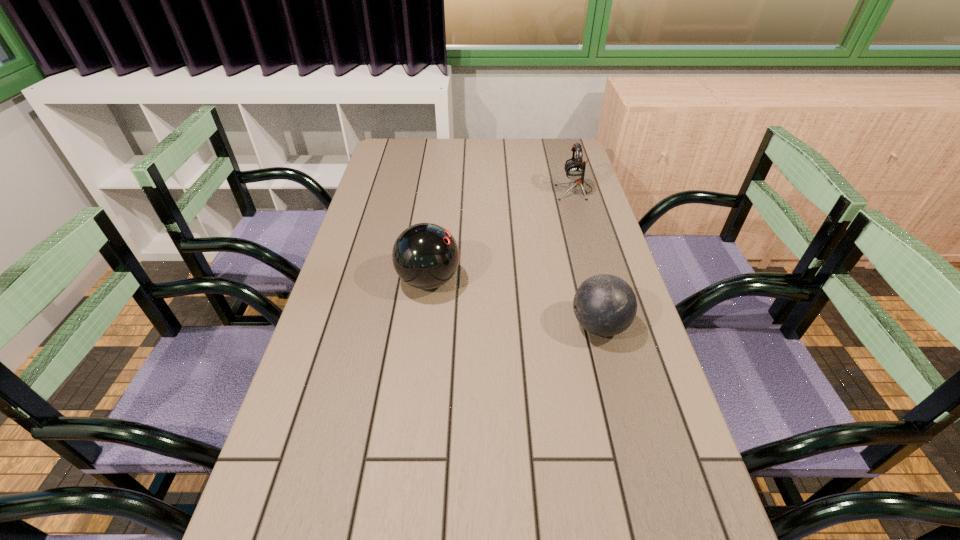
Identify the location of earphone that is at the right edge. The height and width of the screenshot is (540, 960). (575, 168).

You are a GUI agent. You are given a task and a screenshot of the screen. Output one action in this format:
    pyautogui.click(x=<x>, y=<y>)
    Task: Click on the bowling ball located at the right edge
    
    Given the screenshot: What is the action you would take?
    (x=605, y=305)

This screenshot has height=540, width=960. In order to click on vacant position at the far edge of the desktop in this screenshot , I will do `click(504, 139)`.

Where is `vacant region at the left edge of the desktop`? This screenshot has height=540, width=960. vacant region at the left edge of the desktop is located at coordinates (371, 268).

In the image, there is a desktop. Where is `free region at the far right corner`? free region at the far right corner is located at coordinates (563, 165).

The height and width of the screenshot is (540, 960). Identify the location of free space between the shorter bowling ball and the earphone. (587, 258).

Find the location of a particular element. The image size is (960, 540). free spot between the farthest object and the farther bowling ball is located at coordinates (501, 235).

Locate an element on the screen. Image resolution: width=960 pixels, height=540 pixels. free spot between the right bowling ball and the farther bowling ball is located at coordinates (514, 303).

Locate an element on the screen. This screenshot has width=960, height=540. free space between the right bowling ball and the left bowling ball is located at coordinates (514, 303).

The image size is (960, 540). What are the coordinates of `free area in between the farther bowling ball and the earphone` in the screenshot? It's located at (501, 235).